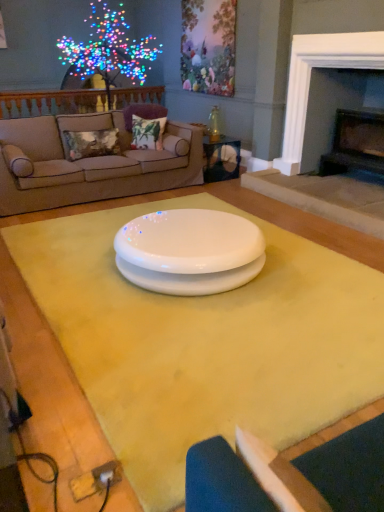
What are the coordinates of `vacant space in front of white glossy plate at center` in the screenshot? It's located at (210, 345).